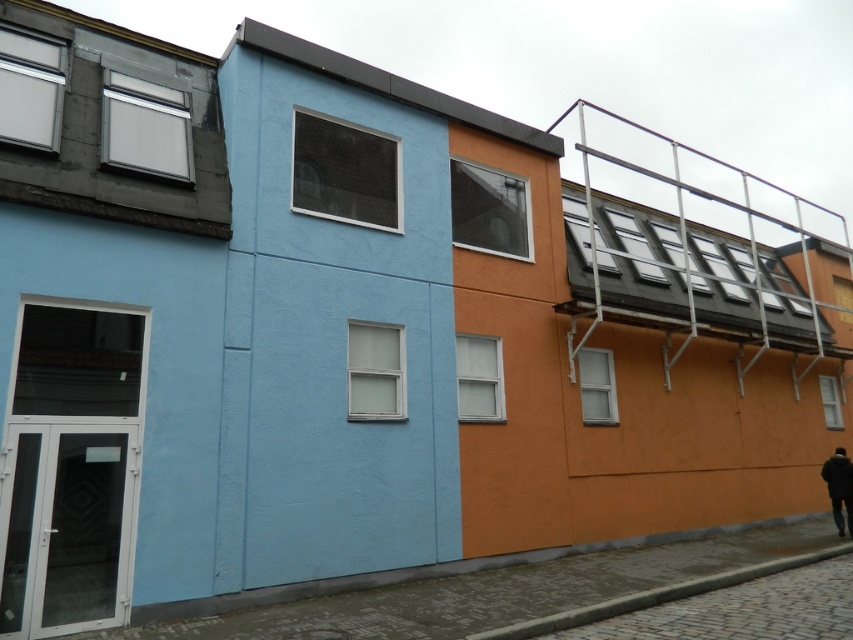
Can you confirm if metallic silver rail at upper right is positioned to the left of dark blue jacket at lower right?

No, metallic silver rail at upper right is not to the left of dark blue jacket at lower right.

Is point (583, 134) closer to camera compared to point (822, 467)?

No, (583, 134) is behind (822, 467).

Is point (722, 269) positioned after point (848, 528)?

Yes, point (722, 269) is farther from viewer.

At what (x,y) coordinates should I click in order to perform the action: click on metallic silver rail at upper right. Please return your answer as a coordinate pair (x, y). Looking at the image, I should click on (709, 266).